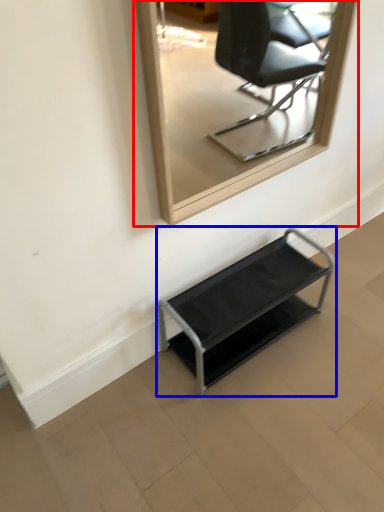
Question: Among these objects, which one is farthest to the camera, mirror (highlighted by a red box) or furniture (highlighted by a blue box)?

Choices:
 (A) mirror
 (B) furniture

Answer: (B)